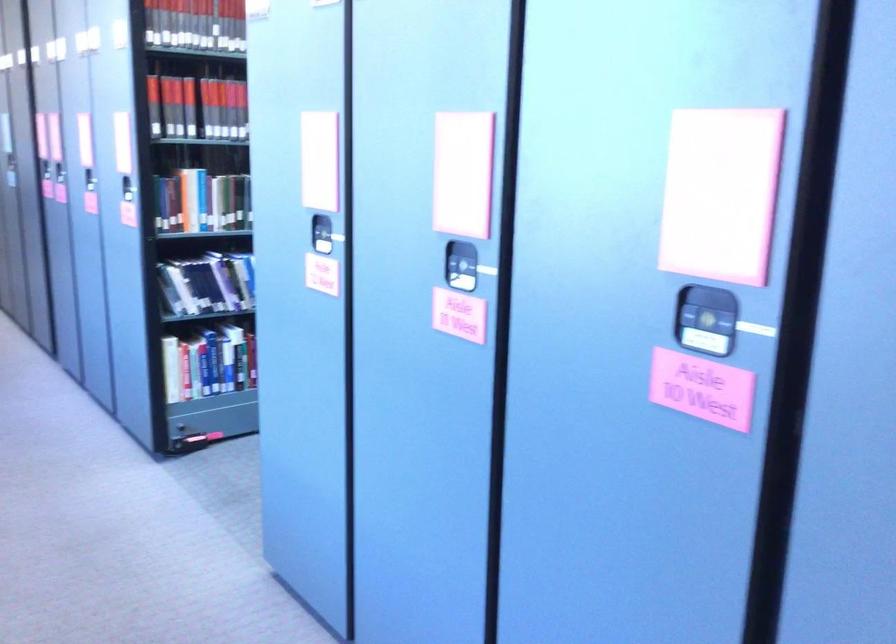
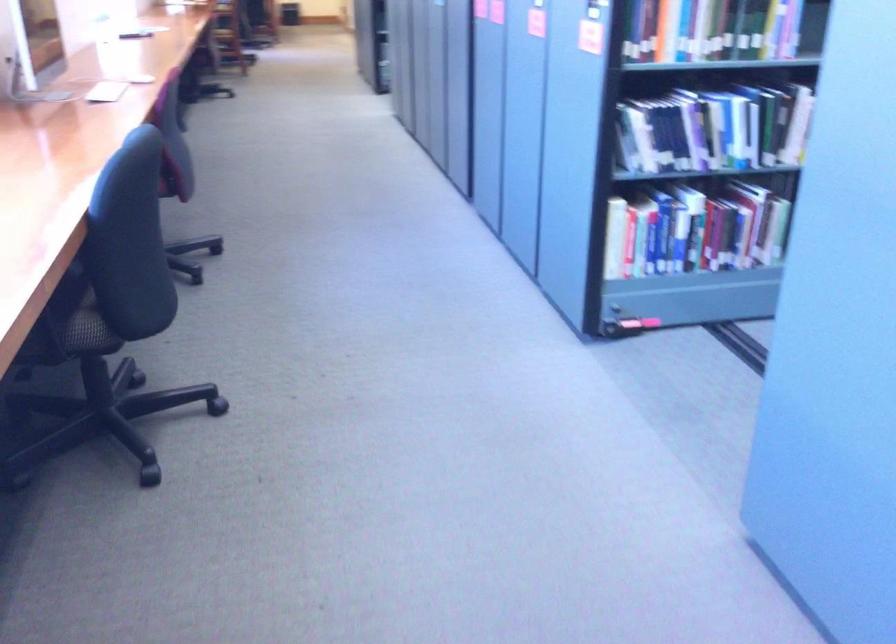
Question: Based on the continuous images, in which direction is the camera rotating? Reply with the corresponding letter.

Choices:
 (A) Left
 (B) Right
 (C) Up
 (D) Down

Answer: (A)